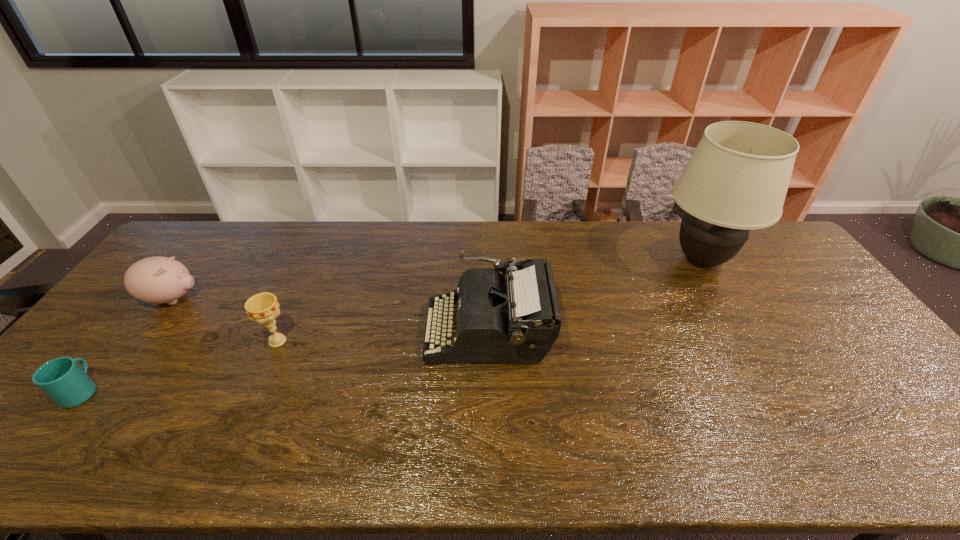
At what (x,y) coordinates should I click in order to perform the action: click on blank area located 0.300m on the front-facing side of the second object from right to left. Please return your answer as a coordinate pair (x, y). The width and height of the screenshot is (960, 540). Looking at the image, I should click on (321, 330).

You are a GUI agent. You are given a task and a screenshot of the screen. Output one action in this format:
    pyautogui.click(x=<x>, y=<y>)
    Task: Click on the vacant space situated 0.210m on the right of the chalice
    The width and height of the screenshot is (960, 540).
    Given the screenshot: What is the action you would take?
    pyautogui.click(x=369, y=341)

Where is `vacant space situated 0.360m at the snout of the piggy bank`? The image size is (960, 540). vacant space situated 0.360m at the snout of the piggy bank is located at coordinates (321, 299).

Identify the location of vacant space located 0.320m on the handle side of the cup. (163, 289).

Locate an element on the screen. This screenshot has height=540, width=960. blank space located on the handle side of the cup is located at coordinates (159, 293).

At what (x,y) coordinates should I click in order to perform the action: click on free space located on the handle side of the cup. Please return your answer as a coordinate pair (x, y). The height and width of the screenshot is (540, 960). Looking at the image, I should click on (120, 343).

In order to click on object present at the far edge in this screenshot , I will do `click(737, 178)`.

Image resolution: width=960 pixels, height=540 pixels. What are the coordinates of `piggy bank located in the left edge section of the desktop` in the screenshot? It's located at (157, 280).

Locate an element on the screen. Image resolution: width=960 pixels, height=540 pixels. cup located at the left edge is located at coordinates (67, 384).

Where is `free spot at the far edge of the desktop`? Image resolution: width=960 pixels, height=540 pixels. free spot at the far edge of the desktop is located at coordinates (478, 239).